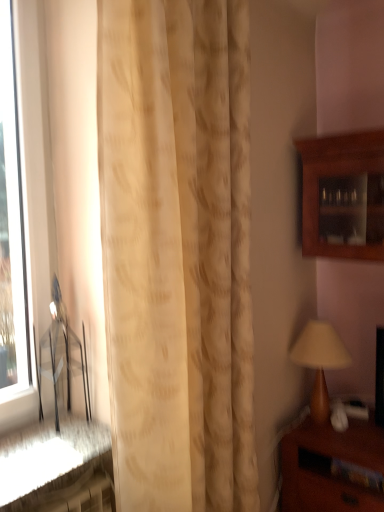
Question: Is metallic silver chair at left in front of or behind beige textured curtain at center in the image?

Choices:
 (A) behind
 (B) front

Answer: (A)

Question: Based on their positions, is metallic silver chair at left located to the left or right of beige textured curtain at center?

Choices:
 (A) right
 (B) left

Answer: (B)

Question: Which object is the closest to the beige textured curtain at center?

Choices:
 (A) metallic silver chair at left
 (B) brown wooden nightstand at lower right
 (C) transparent glass window at left
 (D) matte brown table lamp at right
 (E) wooden cabinet at upper right

Answer: (A)

Question: Which of these objects is positioned closest to the transparent glass window at left?

Choices:
 (A) matte brown table lamp at right
 (B) metallic silver chair at left
 (C) wooden cabinet at upper right
 (D) brown wooden nightstand at lower right
 (E) beige textured curtain at center

Answer: (B)